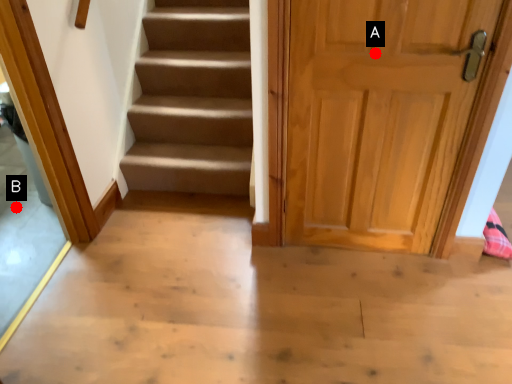
Question: Two points are circled on the image, labeled by A and B beside each circle. Which point is further to the camera?

Choices:
 (A) A is further
 (B) B is further

Answer: (B)